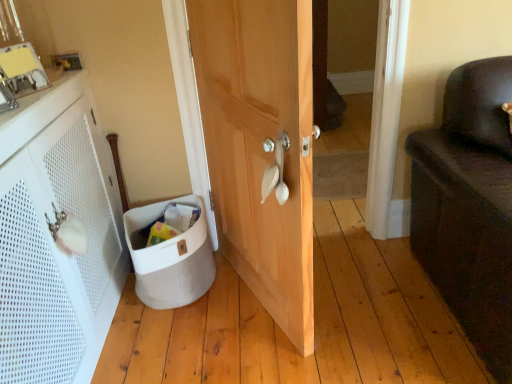
Question: From the image's perspective, is natural wood door at center located above or below white fabric laundry basket at lower left?

Choices:
 (A) below
 (B) above

Answer: (B)

Question: From their relative heights in the image, would you say natural wood door at center is taller or shorter than white fabric laundry basket at lower left?

Choices:
 (A) short
 (B) tall

Answer: (B)

Question: Estimate the real-world distances between objects in this image. Which object is closer to the white perforated cabinet at left?

Choices:
 (A) white plastic door handle at center
 (B) white fabric laundry basket at lower left
 (C) natural wood door at center

Answer: (B)

Question: Estimate the real-world distances between objects in this image. Which object is closer to the natural wood door at center?

Choices:
 (A) white perforated cabinet at left
 (B) white plastic door handle at center
 (C) white fabric laundry basket at lower left

Answer: (B)